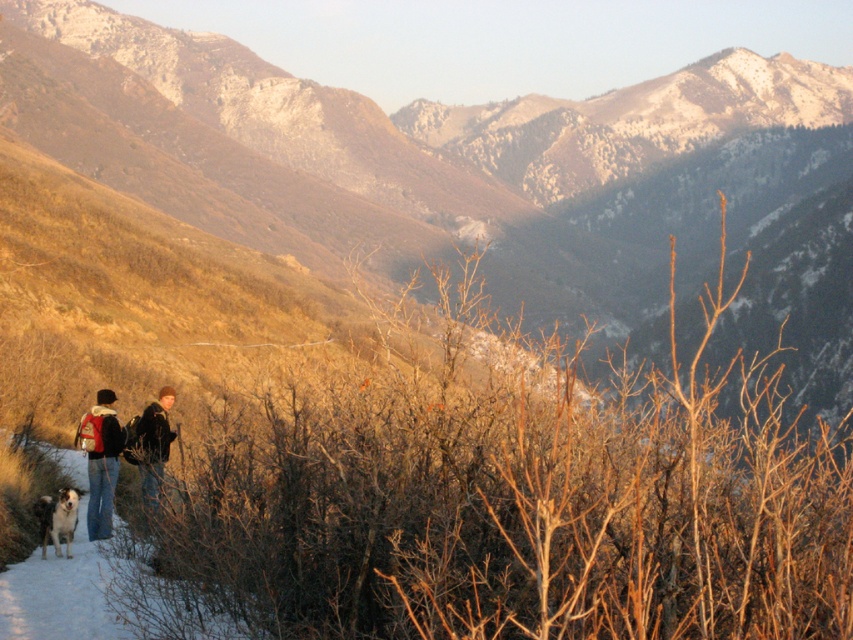
Can you confirm if denim jacket at lower left is thinner than black leather jacket at center?

Correct, denim jacket at lower left's width is less than black leather jacket at center's.

Who is more distant from viewer, (111, 522) or (154, 452)?

Positioned behind is point (111, 522).

Locate an element on the screen. The width and height of the screenshot is (853, 640). denim jacket at lower left is located at coordinates (103, 465).

Between brown grassy hillside at lower left and black and white fur dog at lower left, which one is positioned lower?

black and white fur dog at lower left

Consider the image. Who is shorter, brown grassy hillside at lower left or black and white fur dog at lower left?

black and white fur dog at lower left is shorter.

At what (x,y) coordinates should I click in order to perform the action: click on brown grassy hillside at lower left. Please return your answer as a coordinate pair (x, y). Looking at the image, I should click on (376, 147).

Image resolution: width=853 pixels, height=640 pixels. What are the coordinates of `brown grassy hillside at lower left` in the screenshot? It's located at (376, 147).

How far apart are brown grassy hillside at lower left and black leather jacket at center?

brown grassy hillside at lower left is 373.53 meters from black leather jacket at center.

Is brown grassy hillside at lower left positioned at the back of black leather jacket at center?

That is True.

Does point (518, 157) lie in front of point (166, 426)?

That is False.

This screenshot has width=853, height=640. In order to click on brown grassy hillside at lower left in this screenshot , I will do `click(376, 147)`.